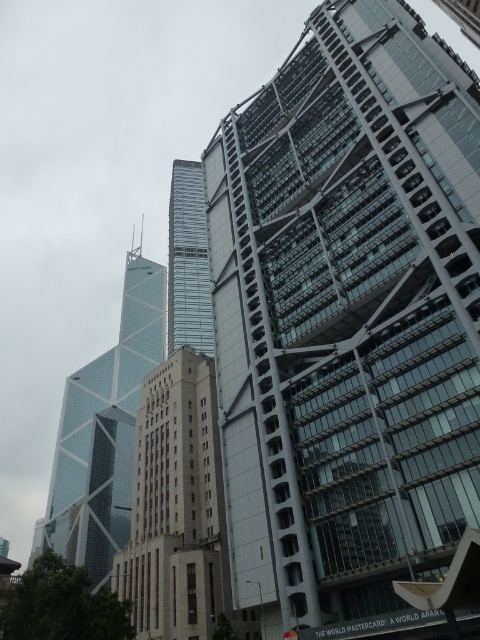
Locate an element on the screen. beige concrete building at center is located at coordinates (176, 506).

What do you see at coordinates (176, 506) in the screenshot? I see `beige concrete building at center` at bounding box center [176, 506].

The width and height of the screenshot is (480, 640). What are the coordinates of `beige concrete building at center` in the screenshot? It's located at (176, 506).

This screenshot has width=480, height=640. I want to click on glassy blue skyscraper at left, so click(x=105, y=429).

Can you confirm if glassy blue skyscraper at left is shorter than glassy steel tower at center?

No.

Describe the element at coordinates (105, 429) in the screenshot. I see `glassy blue skyscraper at left` at that location.

Locate an element on the screen. The height and width of the screenshot is (640, 480). glassy blue skyscraper at left is located at coordinates (105, 429).

Does glassy steel skyscraper at upper right appear over glassy blue skyscraper at left?

Yes, glassy steel skyscraper at upper right is above glassy blue skyscraper at left.

Between glassy steel skyscraper at upper right and glassy blue skyscraper at left, which one appears on the right side from the viewer's perspective?

glassy steel skyscraper at upper right

In order to click on glassy steel skyscraper at upper right in this screenshot , I will do `click(348, 321)`.